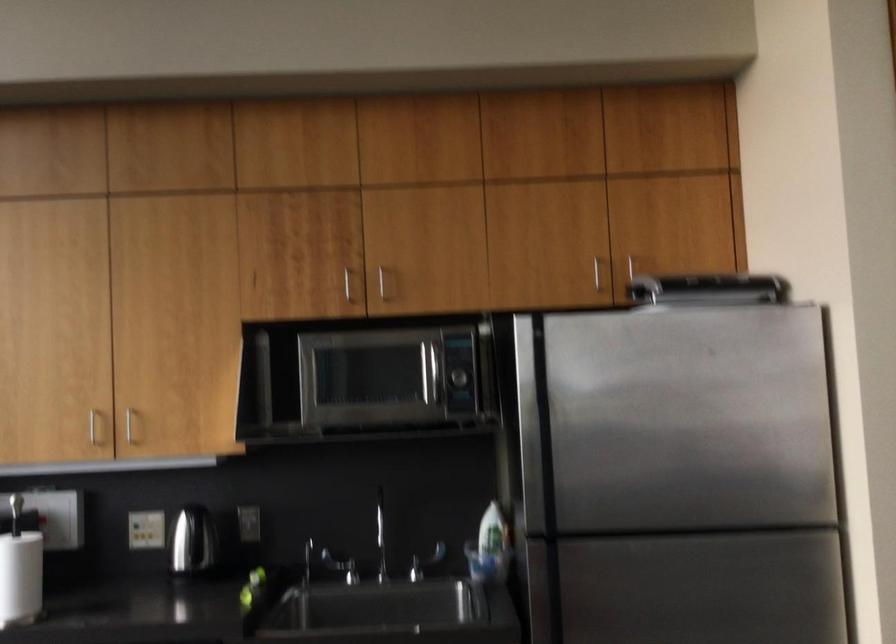
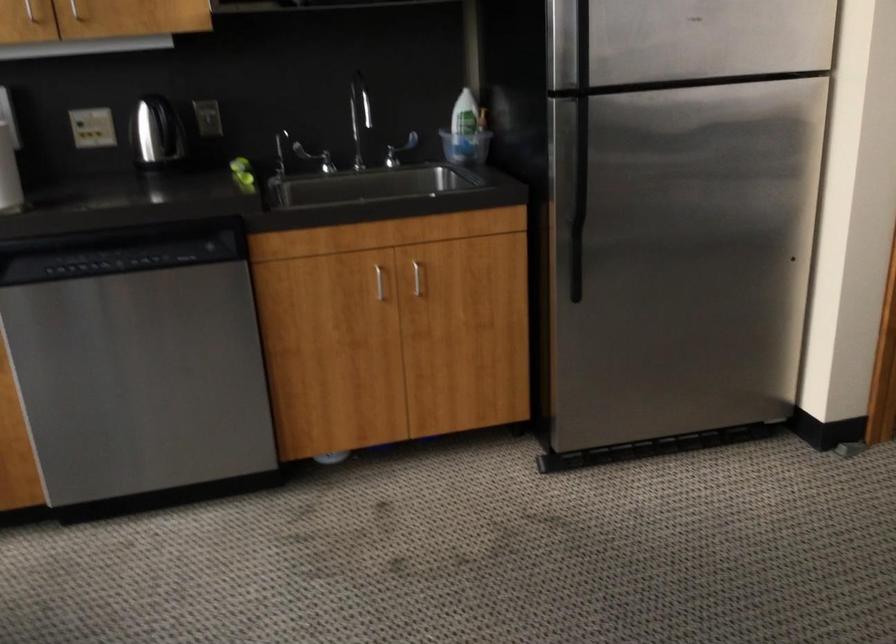
Question: The images are taken continuously from a first-person perspective. In which direction are you moving?

Choices:
 (A) Left
 (B) Right
 (C) Forward
 (D) Backward

Answer: (A)